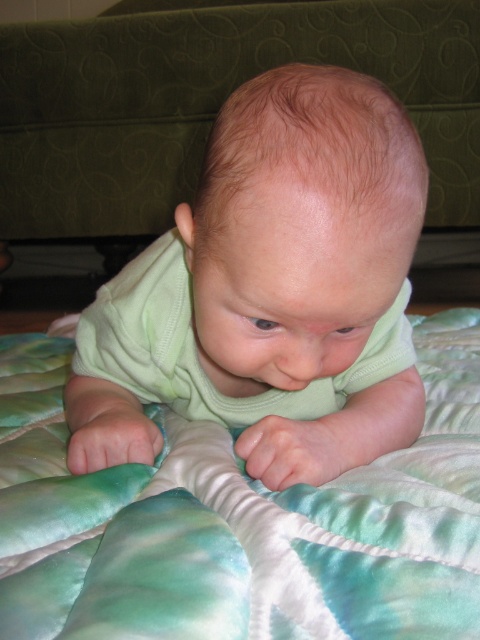
Question: Is green smooth baby at center positioned at the back of green satin quilt at center?

Choices:
 (A) yes
 (B) no

Answer: (A)

Question: Can you confirm if green smooth baby at center is thinner than green satin quilt at center?

Choices:
 (A) yes
 (B) no

Answer: (A)

Question: Is green smooth baby at center further to the viewer compared to green satin quilt at center?

Choices:
 (A) no
 (B) yes

Answer: (B)

Question: Which point appears farthest from the camera in this image?

Choices:
 (A) (267, 412)
 (B) (206, 593)

Answer: (A)

Question: Which point is farther to the camera?

Choices:
 (A) green satin quilt at center
 (B) green smooth baby at center

Answer: (B)